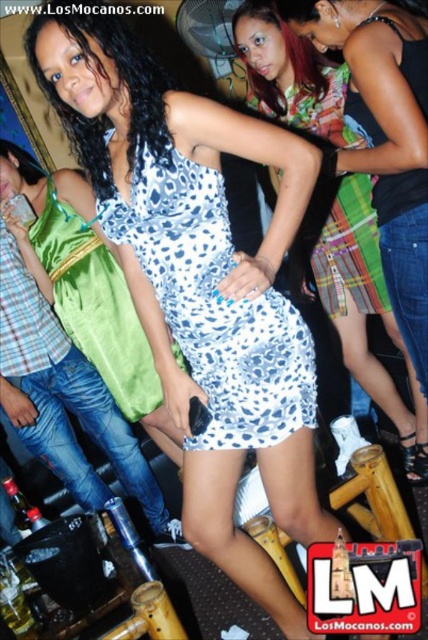
Is satin green dress at left above printed fabric dress at center?

No, satin green dress at left is not above printed fabric dress at center.

Who is more distant from viewer, (131,380) or (317,125)?

Point (131,380)

Locate an element on the screen. satin green dress at left is located at coordinates (95, 305).

Does blue leopard print dress at center have a smaller size compared to white leopard print dress at center?

Yes, blue leopard print dress at center is smaller than white leopard print dress at center.

Does blue leopard print dress at center have a lesser height compared to white leopard print dress at center?

Yes.

Is point (262, 397) positioned behind point (332, 272)?

No, (262, 397) is in front of (332, 272).

The width and height of the screenshot is (428, 640). In order to click on blue leopard print dress at center in this screenshot , I will do `click(214, 305)`.

Which is more to the right, blue leopard print dress at center or printed fabric dress at center?

Positioned to the right is printed fabric dress at center.

Can you confirm if blue leopard print dress at center is positioned to the left of printed fabric dress at center?

Correct, you'll find blue leopard print dress at center to the left of printed fabric dress at center.

Image resolution: width=428 pixels, height=640 pixels. In order to click on blue leopard print dress at center in this screenshot , I will do `click(214, 305)`.